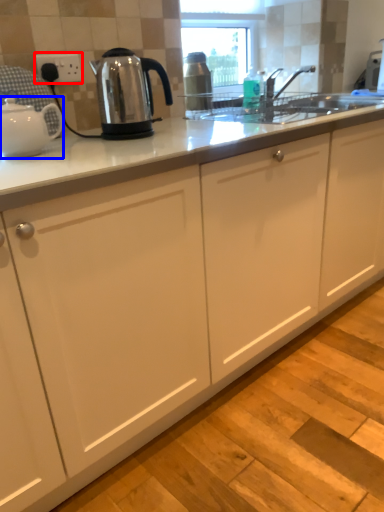
Question: Which of the following is the closest to the observer, electric outlet (highlighted by a red box) or kettle (highlighted by a blue box)?

Choices:
 (A) electric outlet
 (B) kettle

Answer: (B)